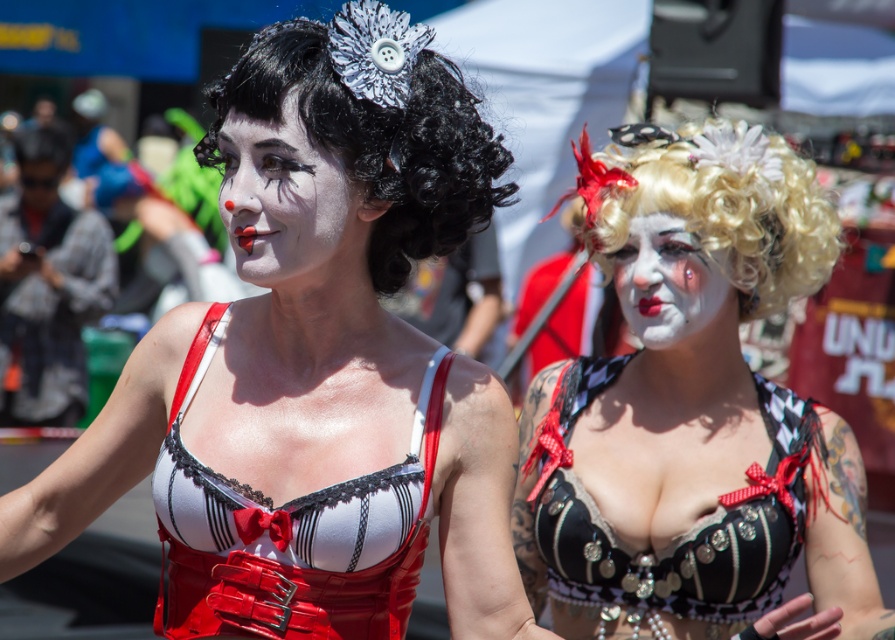
Question: Which point is farther to the camera?

Choices:
 (A) (695, 218)
 (B) (572, 404)
 (C) (248, 129)

Answer: (B)

Question: Which point appears closest to the camera in this image?

Choices:
 (A) (737, 504)
 (B) (345, 561)
 (C) (788, 216)
 (D) (661, 301)

Answer: (B)

Question: Observing the image, what is the correct spatial positioning of matte white lace bra at center in reference to blonde curly wig at upper right?

Choices:
 (A) above
 (B) below

Answer: (B)

Question: Which point is closer to the camera taking this photo?

Choices:
 (A) 686,248
 (B) 226,220
 (C) 203,342
 (D) 774,440

Answer: (B)

Question: Does matte black corset at center appear over black leather bra at center?

Choices:
 (A) no
 (B) yes

Answer: (B)

Question: Observing the image, what is the correct spatial positioning of white matte face at center in reference to matte white face at center?

Choices:
 (A) below
 (B) above

Answer: (B)